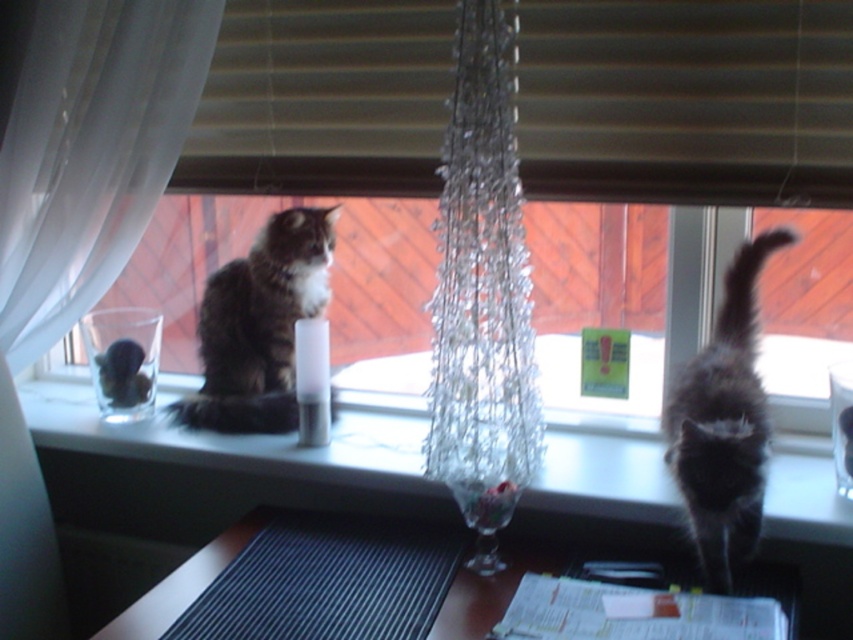
Is white sheer curtain at upper left to the right of wooden table at lower center from the viewer's perspective?

Incorrect, white sheer curtain at upper left is not on the right side of wooden table at lower center.

Which of these two, white sheer curtain at upper left or wooden table at lower center, stands taller?

white sheer curtain at upper left

Between point (148, 92) and point (540, 566), which one is positioned in front?

Point (540, 566) is in front.

The height and width of the screenshot is (640, 853). What are the coordinates of `white sheer curtain at upper left` in the screenshot? It's located at (90, 152).

Does black fluffy cat at right appear over wooden table at lower center?

Indeed, black fluffy cat at right is positioned over wooden table at lower center.

In the scene shown: Who is higher up, black fluffy cat at right or wooden table at lower center?

black fluffy cat at right is higher up.

Locate an element on the screen. The width and height of the screenshot is (853, 640). black fluffy cat at right is located at coordinates (724, 424).

Who is more forward, (642, 26) or (572, 92)?

Positioned in front is point (642, 26).

The width and height of the screenshot is (853, 640). What do you see at coordinates (686, 100) in the screenshot? I see `clear glass candle at center` at bounding box center [686, 100].

This screenshot has height=640, width=853. I want to click on clear glass candle at center, so click(686, 100).

You are a GUI agent. You are given a task and a screenshot of the screen. Output one action in this format:
    pyautogui.click(x=<x>, y=<y>)
    Task: Click on the clear glass candle at center
    
    Given the screenshot: What is the action you would take?
    pyautogui.click(x=686, y=100)